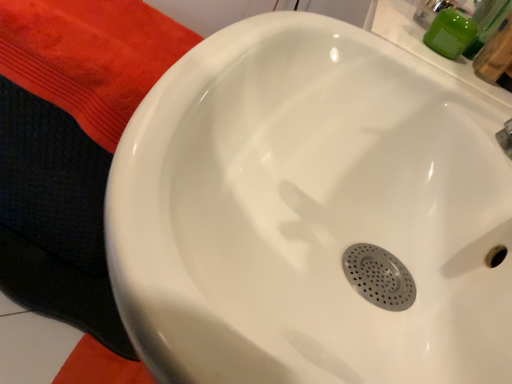
This screenshot has width=512, height=384. What do you see at coordinates (506, 138) in the screenshot?
I see `silver metallic faucet at upper right` at bounding box center [506, 138].

Image resolution: width=512 pixels, height=384 pixels. In order to click on silver metallic faucet at upper right in this screenshot , I will do `click(506, 138)`.

In the scene shown: Measure the distance between point (451, 56) and camera.

A distance of 22.48 inches exists between point (451, 56) and camera.

Where is `green matte soap dispenser at upper right`? green matte soap dispenser at upper right is located at coordinates (450, 32).

What do you see at coordinates (450, 32) in the screenshot? I see `green matte soap dispenser at upper right` at bounding box center [450, 32].

The height and width of the screenshot is (384, 512). Find the location of `silver metallic faucet at upper right`. silver metallic faucet at upper right is located at coordinates (506, 138).

Based on the photo, between silver metallic faucet at upper right and green matte soap dispenser at upper right, which one appears on the right side from the viewer's perspective?

silver metallic faucet at upper right is more to the right.

Between silver metallic faucet at upper right and green matte soap dispenser at upper right, which one is positioned in front?

silver metallic faucet at upper right is more forward.

Which is in front, point (502, 132) or point (459, 8)?

The point (502, 132) is more forward.

From the image's perspective, is silver metallic faucet at upper right located above or below green matte soap dispenser at upper right?

silver metallic faucet at upper right is below green matte soap dispenser at upper right.

From a real-world perspective, which object rests below the other?

From a 3D spatial view, green matte soap dispenser at upper right is below.

Considering the sizes of silver metallic faucet at upper right and green matte soap dispenser at upper right in the image, is silver metallic faucet at upper right wider or thinner than green matte soap dispenser at upper right?

Clearly, silver metallic faucet at upper right has more width compared to green matte soap dispenser at upper right.

Is silver metallic faucet at upper right taller than green matte soap dispenser at upper right?

Yes, silver metallic faucet at upper right is taller than green matte soap dispenser at upper right.

Based on their sizes in the image, would you say silver metallic faucet at upper right is bigger or smaller than green matte soap dispenser at upper right?

silver metallic faucet at upper right is bigger than green matte soap dispenser at upper right.

Is silver metallic faucet at upper right surrounding green matte soap dispenser at upper right?

Actually, green matte soap dispenser at upper right is outside silver metallic faucet at upper right.

Is silver metallic faucet at upper right not close to green matte soap dispenser at upper right?

silver metallic faucet at upper right is near green matte soap dispenser at upper right, not far away.

Is silver metallic faucet at upper right looking in the opposite direction of green matte soap dispenser at upper right?

No, silver metallic faucet at upper right is not facing away from green matte soap dispenser at upper right.

How distant is silver metallic faucet at upper right from green matte soap dispenser at upper right?

A distance of 7.73 inches exists between silver metallic faucet at upper right and green matte soap dispenser at upper right.

At what (x,y) coordinates should I click in order to perform the action: click on plumbing fixture on the right of green matte soap dispenser at upper right. Please return your answer as a coordinate pair (x, y). Image resolution: width=512 pixels, height=384 pixels. Looking at the image, I should click on (506, 138).

Considering the relative positions of green matte soap dispenser at upper right and silver metallic faucet at upper right in the image provided, is green matte soap dispenser at upper right to the right of silver metallic faucet at upper right from the viewer's perspective?

Incorrect, green matte soap dispenser at upper right is not on the right side of silver metallic faucet at upper right.

Is green matte soap dispenser at upper right behind silver metallic faucet at upper right?

That is True.

Does point (439, 18) come behind point (502, 134)?

That is True.

From the image's perspective, which is above, green matte soap dispenser at upper right or silver metallic faucet at upper right?

From the image's view, green matte soap dispenser at upper right is above.

From a real-world perspective, between green matte soap dispenser at upper right and silver metallic faucet at upper right, who is vertically higher?

silver metallic faucet at upper right.

Between green matte soap dispenser at upper right and silver metallic faucet at upper right, which one has smaller width?

Thinner between the two is green matte soap dispenser at upper right.

Between green matte soap dispenser at upper right and silver metallic faucet at upper right, which one has more height?

Standing taller between the two is silver metallic faucet at upper right.

Considering the sizes of objects green matte soap dispenser at upper right and silver metallic faucet at upper right in the image provided, who is bigger, green matte soap dispenser at upper right or silver metallic faucet at upper right?

Bigger between the two is silver metallic faucet at upper right.

Is silver metallic faucet at upper right completely or partially inside green matte soap dispenser at upper right?

Actually, silver metallic faucet at upper right is outside green matte soap dispenser at upper right.

Would you say green matte soap dispenser at upper right is a long distance from silver metallic faucet at upper right?

No, there isn't a large distance between green matte soap dispenser at upper right and silver metallic faucet at upper right.

Is green matte soap dispenser at upper right oriented away from silver metallic faucet at upper right?

No, green matte soap dispenser at upper right is not facing away from silver metallic faucet at upper right.

Where is `plumbing fixture above the green matte soap dispenser at upper right (from a real-world perspective)`? This screenshot has height=384, width=512. plumbing fixture above the green matte soap dispenser at upper right (from a real-world perspective) is located at coordinates (506, 138).

Where is `plumbing fixture below the green matte soap dispenser at upper right (from the image's perspective)`? plumbing fixture below the green matte soap dispenser at upper right (from the image's perspective) is located at coordinates (506, 138).

At what (x,y) coordinates should I click in order to perform the action: click on plumbing fixture in front of the green matte soap dispenser at upper right. Please return your answer as a coordinate pair (x, y). This screenshot has height=384, width=512. Looking at the image, I should click on (506, 138).